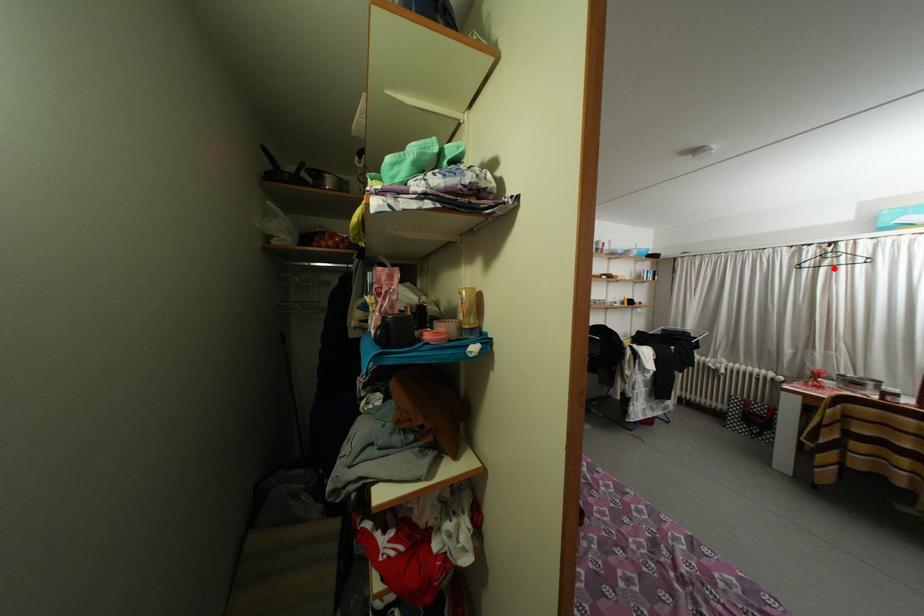
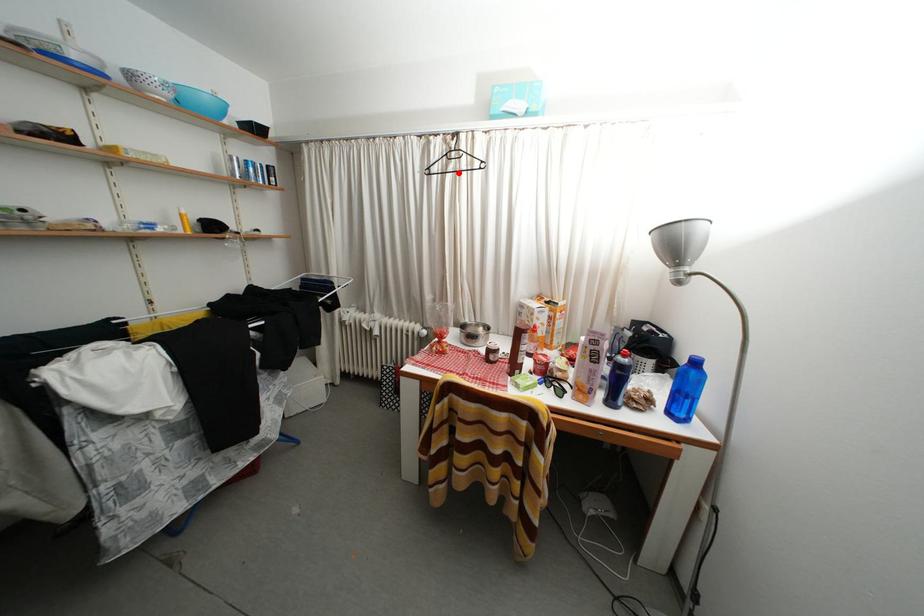
I am providing you with two images of the same scene from different viewpoints. A red point is marked on the first image and another point is marked on the second image. Is the marked point in image1 the same physical position as the marked point in image2?

Yes